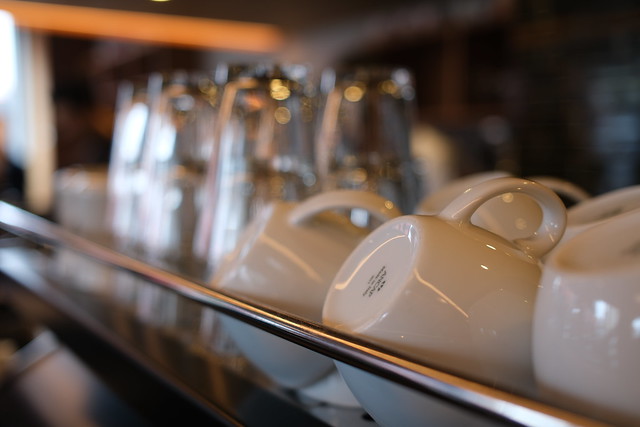
Identify the location of cups. (129, 123), (185, 134), (260, 128), (364, 114).